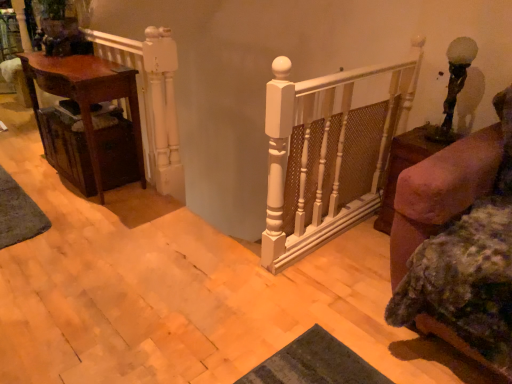
Locate an element on the screen. free space in front of matte brown table at left is located at coordinates (81, 222).